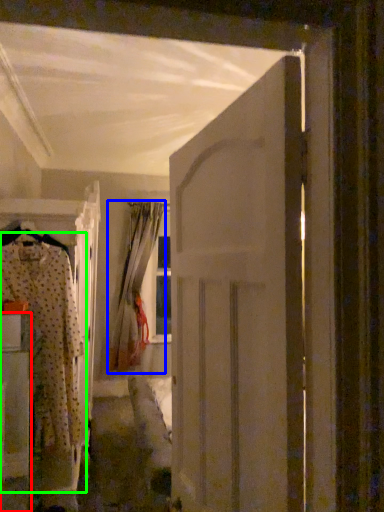
Question: Which object is the farthest from furniture (highlighted by a red box)? Choose among these: curtain (highlighted by a blue box) or clothing (highlighted by a green box).

Choices:
 (A) curtain
 (B) clothing

Answer: (A)